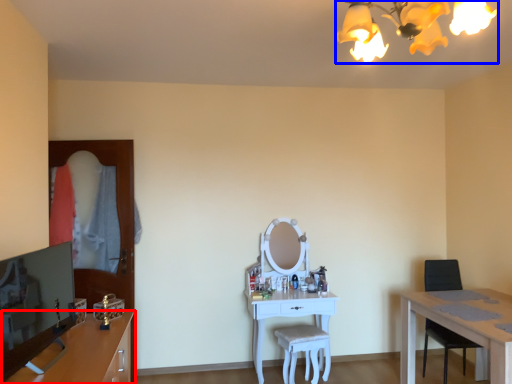
Question: Which object is further to the camera taking this photo, cabinetry (highlighted by a red box) or light fixture (highlighted by a blue box)?

Choices:
 (A) cabinetry
 (B) light fixture

Answer: (A)